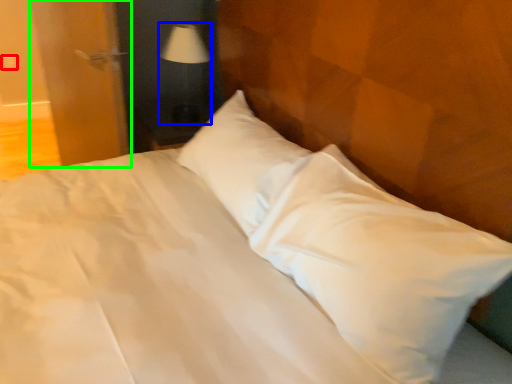
Question: Which object is positioned farthest from electric outlet (highlighted by a red box)? Select from table lamp (highlighted by a blue box) and door (highlighted by a green box).

Choices:
 (A) table lamp
 (B) door

Answer: (A)